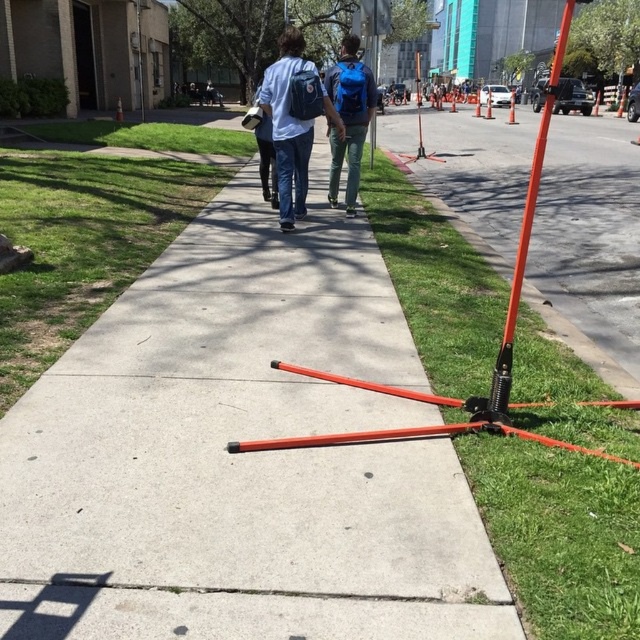
You are a delivery person who needs to place a small package on the sidewalk. The orange grass at lower right and the matte blue backpack at center are in the way. Which object should you move to make space?

The orange grass at lower right has a larger size compared to the matte blue backpack at center, so you should move the orange grass at lower right to make more space for the package.

You are a delivery person trying to navigate through the sidewalk scene. You need to place a box between the green grass at lower left and the orange metallic tripod at center. Which side should you place the box on to ensure it fits within the available space?

The green grass at lower left has a smaller width compared to the orange metallic tripod at center. Therefore, you should place the box on the side of the orange metallic tripod at center to ensure it fits within the available space.

You are standing on the sidewalk and see two points marked on the ground. Which point is closer to you, point (54, 266) or point (419, 99)?

→ Point (54, 266) is closer to the viewer than point (419, 99).